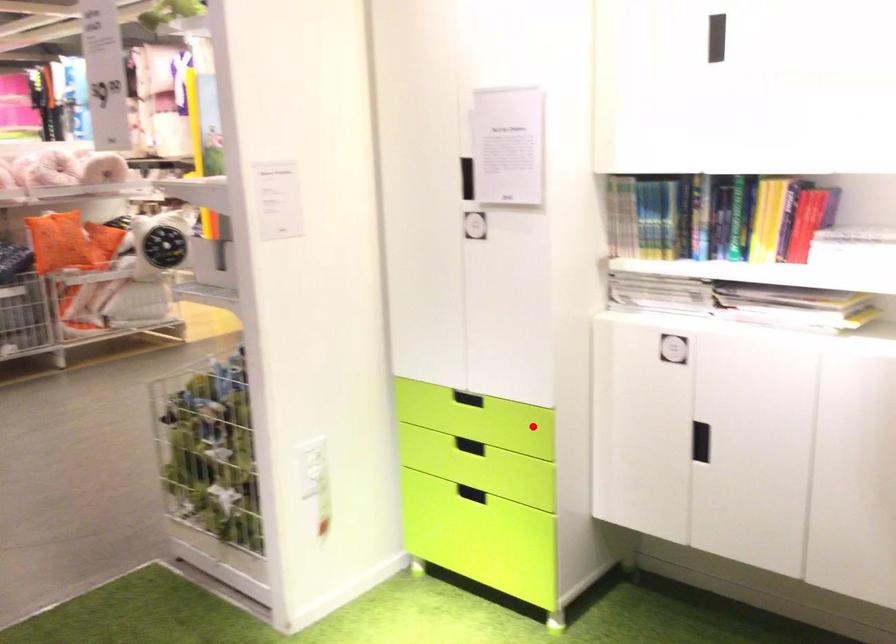
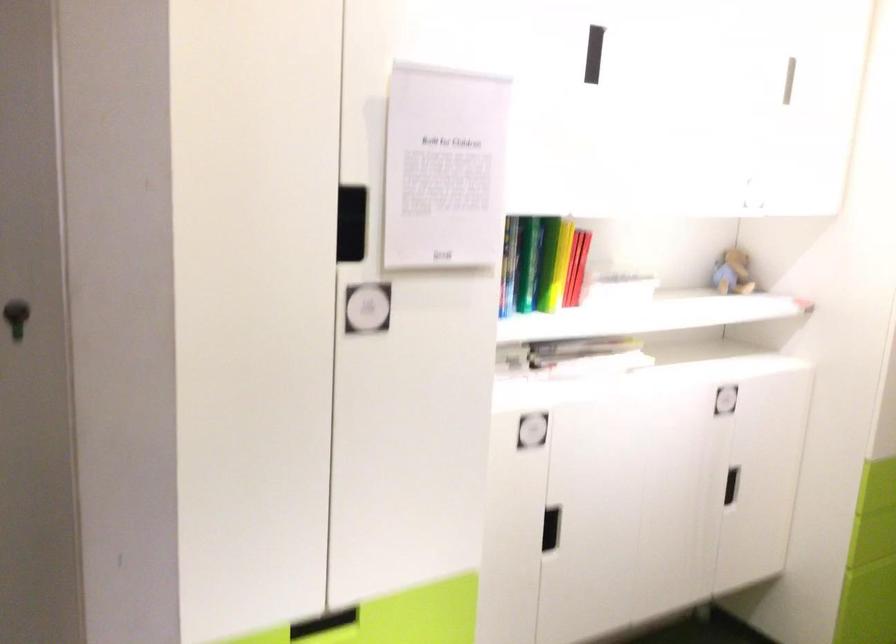
Question: I am providing you with two images of the same scene from different viewpoints. In image1, a red point is highlighted. Considering the same 3D point in image2, which of the following is correct?

Choices:
 (A) It is closer
 (B) It is farther

Answer: (A)